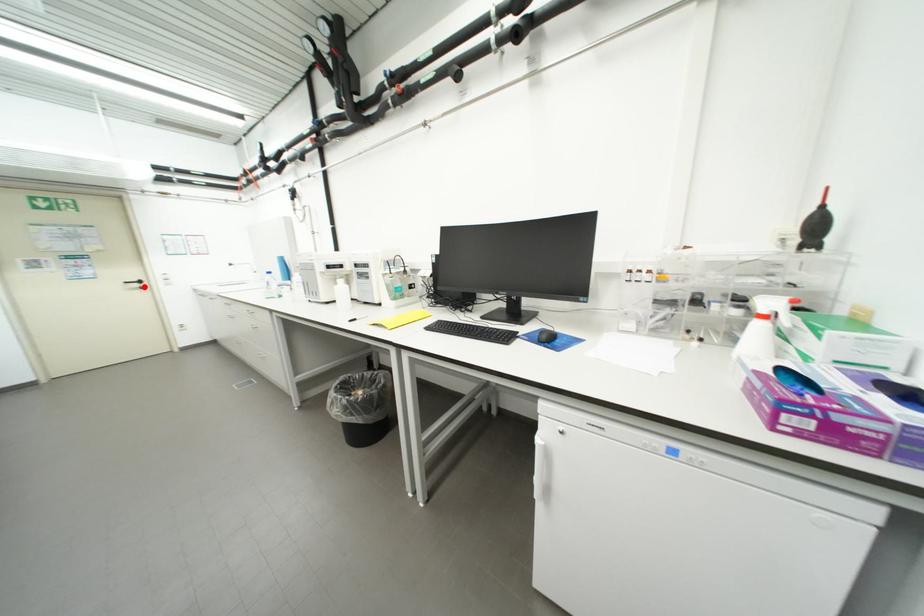
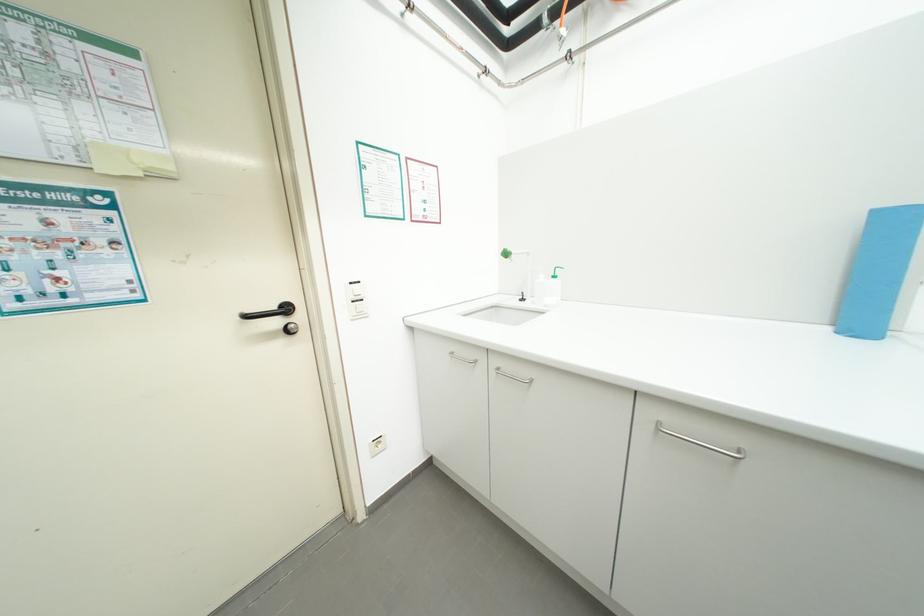
Find the pixel in the second image that matches the highlighted location in the first image.

(285, 323)